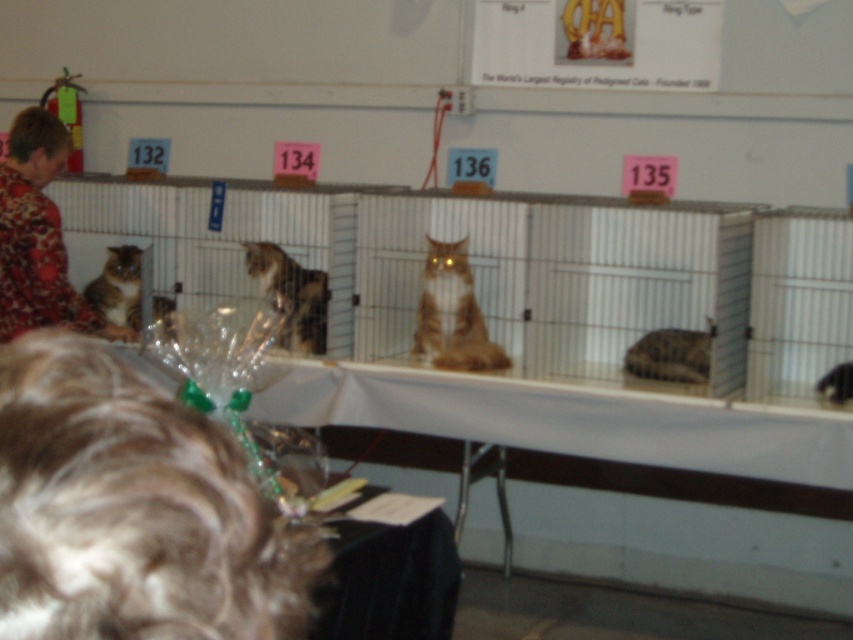
You are at a cat show and want to place a new cat cage on the table at center. The table is represented by the point at coordinates point (680, 531). Is there enough space to place the new cage between the existing cages numbered 132 and 134?

The white plastic table at center is represented by point (680, 531). However, the description does not provide information about the spacing between existing cages or the table dimensions, so it is impossible to determine if there is enough space to place a new cage between cages numbered 132 and 134.

You are a photographer standing at the front row of the cat show. You want to take a closeup photo of the brown fur cat at center. If your camera has a minimum focusing distance of 2.5 meters, will you be able to take the photo without moving closer?

The brown fur cat at center is 3.04 meters away from the camera. Since 3.04 meters is greater than the camera minimum focusing distance of 2.5 meters, you can take the photo without moving closer.

You are at a cat show and want to compare the sizes of the two cats in the cages. The brown fur cat at center and the fluffy brown cat at left are both in their respective cages. Which cat appears to be smaller based on their cage positions?

The brown fur cat at center appears smaller because its width is less than the fluffy brown cat at left.